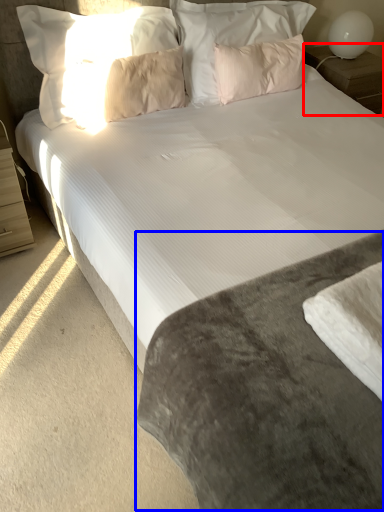
Question: Among these objects, which one is farthest to the camera, nightstand (highlighted by a red box) or mattress (highlighted by a blue box)?

Choices:
 (A) nightstand
 (B) mattress

Answer: (A)